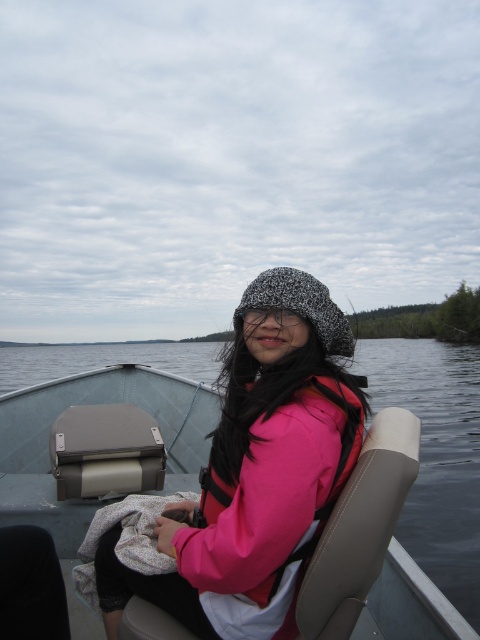
Question: Is pink fleece jacket at center bigger than pink fabric life jacket at center?

Choices:
 (A) yes
 (B) no

Answer: (A)

Question: Can you confirm if pink fabric life jacket at center is thinner than speckled knit hat at center?

Choices:
 (A) no
 (B) yes

Answer: (A)

Question: From the image, what is the correct spatial relationship of pink fabric life jacket at center in relation to speckled knit hat at center?

Choices:
 (A) right
 (B) left

Answer: (B)

Question: Which is nearer to the pink fleece jacket at center?

Choices:
 (A) pink fabric life jacket at center
 (B) speckled knit hat at center

Answer: (A)

Question: Estimate the real-world distances between objects in this image. Which object is farther from the speckled knit hat at center?

Choices:
 (A) pink fabric life jacket at center
 (B) pink fleece jacket at center

Answer: (A)

Question: Which of the following is the closest to the observer?

Choices:
 (A) pink fabric life jacket at center
 (B) pink fleece jacket at center
 (C) speckled knit hat at center

Answer: (A)